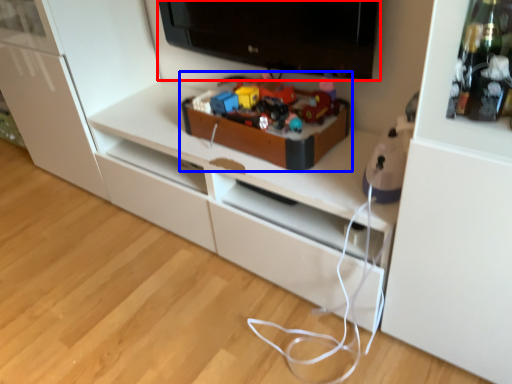
Question: Among these objects, which one is farthest to the camera, television (highlighted by a red box) or toy (highlighted by a blue box)?

Choices:
 (A) television
 (B) toy

Answer: (B)